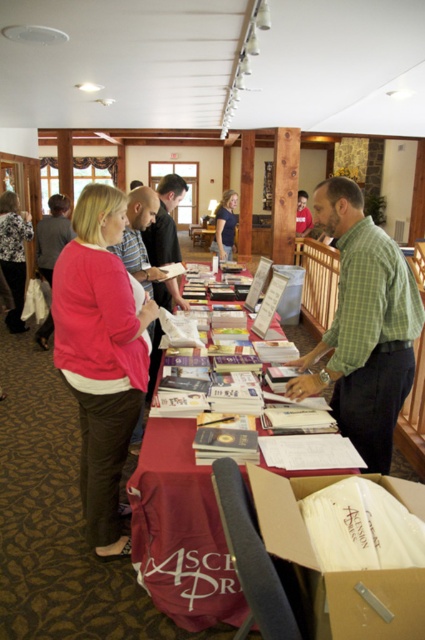
You are a guest at this event and need to place a 1.5 meter long banner between the white paper table at center and the blue cotton shirt at center. Is there enough space to place it without moving either object?

The distance between the white paper table at center and the blue cotton shirt at center is 4.73 meters. Since the banner is 1.5 meters long, there is sufficient space to place it between them without needing to move either object.

You are standing in the conference room and want to reach the point at coordinates point (217, 211). There is an obstacle at point (78, 198). Can you walk directly to your destination without going around the obstacle?

Point (78, 198) is in front of point (217, 211), so the obstacle is blocking the direct path to your destination. You will need to go around it.

You are planning to place a rectangular box that is 2 meters long on the white paper table at center. Considering the blue cotton shirt at center is currently occupying part of the table, can the box fit on the table?

The white paper table at center has a larger width than the blue cotton shirt at center. Since the table is wider, there might be enough space to accommodate the 2 meter long box, provided the shirt isn not blocking the entire length. However, without knowing the exact dimensions of the table and the shirt, it is uncertain. The description only states the table is wider, not longer.